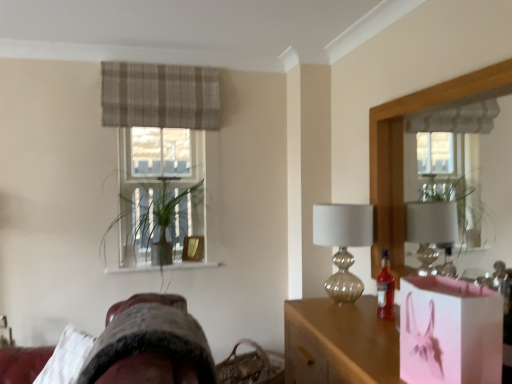
The height and width of the screenshot is (384, 512). What are the coordinates of `free spot above pink paper bag at lower right (from a real-world perspective)` in the screenshot? It's located at (446, 286).